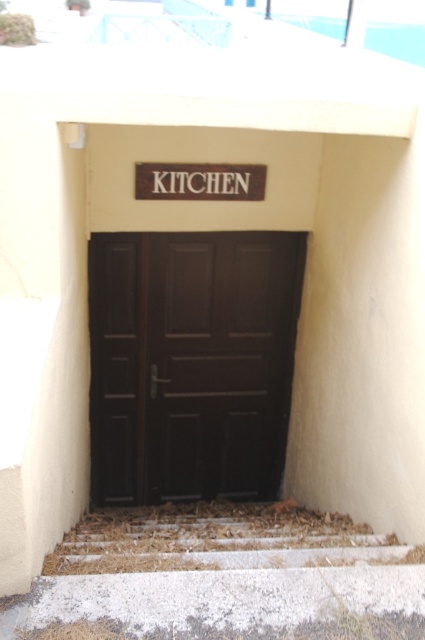
Between brown wooden stairs at lower center and brown wooden sign at center, which one appears on the left side from the viewer's perspective?

From the viewer's perspective, brown wooden sign at center appears more on the left side.

You are a GUI agent. You are given a task and a screenshot of the screen. Output one action in this format:
    pyautogui.click(x=<x>, y=<y>)
    Task: Click on the brown wooden stairs at lower center
    
    Given the screenshot: What is the action you would take?
    pyautogui.click(x=215, y=538)

Looking at this image, who is positioned more to the left, matte dark brown door at center or brown wooden sign at center?

matte dark brown door at center

Is point (200, 340) more distant than point (189, 166)?

Yes, it is behind point (189, 166).

Is point (192, 490) closer to camera compared to point (255, 177)?

That is False.

Find the location of a particular element. Image resolution: width=425 pixels, height=640 pixels. matte dark brown door at center is located at coordinates (190, 362).

Does point (161, 253) lie in front of point (299, 556)?

That is False.

Measure the distance between point (274, 243) and camera.

The distance of point (274, 243) from camera is 4.14 meters.

The width and height of the screenshot is (425, 640). What do you see at coordinates (190, 362) in the screenshot?
I see `matte dark brown door at center` at bounding box center [190, 362].

This screenshot has height=640, width=425. In order to click on matte dark brown door at center in this screenshot , I will do `click(190, 362)`.